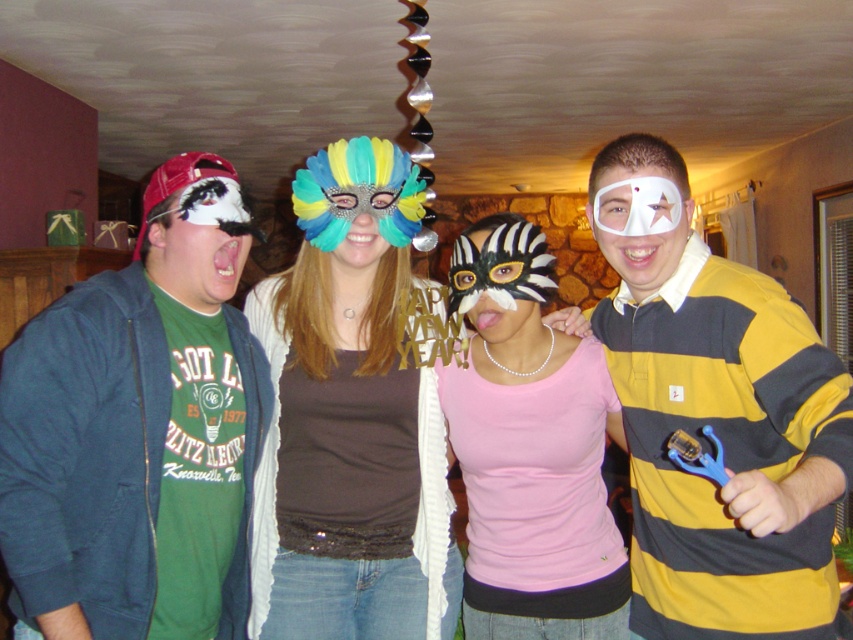
Between matte green t-shirt at left and multicolored feather mask at center, which one is positioned lower?

multicolored feather mask at center

Can you confirm if matte green t-shirt at left is smaller than multicolored feather mask at center?

No, matte green t-shirt at left is not smaller than multicolored feather mask at center.

Locate an element on the screen. This screenshot has height=640, width=853. matte green t-shirt at left is located at coordinates (138, 429).

In the scene shown: Is zebra-patterned mask at center shorter than white paper mask at center?

No, zebra-patterned mask at center is not shorter than white paper mask at center.

Is point (508, 236) closer to viewer compared to point (668, 232)?

No, (508, 236) is further to viewer.

This screenshot has width=853, height=640. Identify the location of zebra-patterned mask at center. (502, 285).

Which is above, white paper mask at center or matte black mask at left?

white paper mask at center is higher up.

Is white paper mask at center behind matte black mask at left?

No, it is not.

Which is in front, point (657, 179) or point (216, 259)?

Point (657, 179)

Image resolution: width=853 pixels, height=640 pixels. What are the coordinates of `white paper mask at center` in the screenshot? It's located at (640, 232).